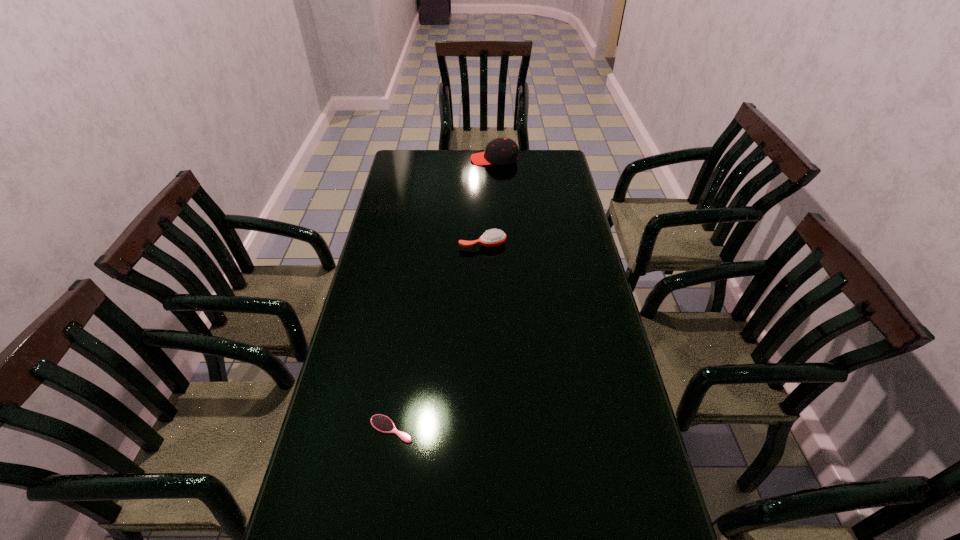
Where is `cap`? cap is located at coordinates (501, 151).

This screenshot has height=540, width=960. I want to click on the tallest object, so click(501, 151).

The image size is (960, 540). Find the location of `the right hairbrush`. the right hairbrush is located at coordinates (494, 237).

This screenshot has height=540, width=960. Find the location of `the second farthest object`. the second farthest object is located at coordinates (494, 237).

Locate an element on the screen. This screenshot has width=960, height=540. the leftmost object is located at coordinates (382, 423).

Where is `the shorter hairbrush`? This screenshot has height=540, width=960. the shorter hairbrush is located at coordinates pyautogui.click(x=382, y=423).

What are the coordinates of `vacant area located 0.060m on the front-facing side of the farthest object` in the screenshot? It's located at (458, 159).

At what (x,y) coordinates should I click in order to perform the action: click on vacant region located 0.140m on the front-facing side of the farthest object. Please return your answer as a coordinate pair (x, y). This screenshot has width=960, height=540. Looking at the image, I should click on (441, 159).

Where is `vacant space positioned on the front-facing side of the farthest object`? The height and width of the screenshot is (540, 960). vacant space positioned on the front-facing side of the farthest object is located at coordinates (417, 159).

Locate an element on the screen. This screenshot has width=960, height=540. free space located 0.260m on the right of the taller hairbrush is located at coordinates (578, 244).